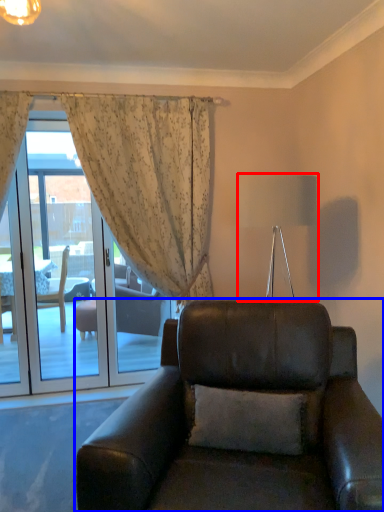
Question: Which object appears closest to the camera in this image, lamp (highlighted by a red box) or chair (highlighted by a blue box)?

Choices:
 (A) lamp
 (B) chair

Answer: (B)